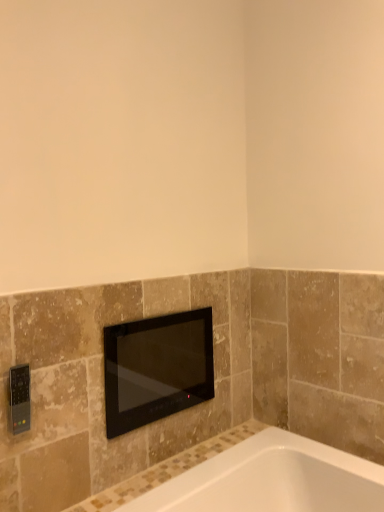
Question: In the image, is black plastic remote control at lower left on the left side or the right side of black glass television at center?

Choices:
 (A) left
 (B) right

Answer: (A)

Question: From the image's perspective, is black plastic remote control at lower left located above or below black glass television at center?

Choices:
 (A) above
 (B) below

Answer: (A)

Question: Considering their positions, is black plastic remote control at lower left located in front of or behind black glass television at center?

Choices:
 (A) front
 (B) behind

Answer: (A)

Question: Considering the positions of black glass television at center and black plastic remote control at lower left in the image, is black glass television at center bigger or smaller than black plastic remote control at lower left?

Choices:
 (A) small
 (B) big

Answer: (B)

Question: From the image's perspective, is black glass television at center located above or below black plastic remote control at lower left?

Choices:
 (A) below
 (B) above

Answer: (A)

Question: From a real-world perspective, is black glass television at center positioned above or below black plastic remote control at lower left?

Choices:
 (A) above
 (B) below

Answer: (B)

Question: From their relative heights in the image, would you say black glass television at center is taller or shorter than black plastic remote control at lower left?

Choices:
 (A) short
 (B) tall

Answer: (B)